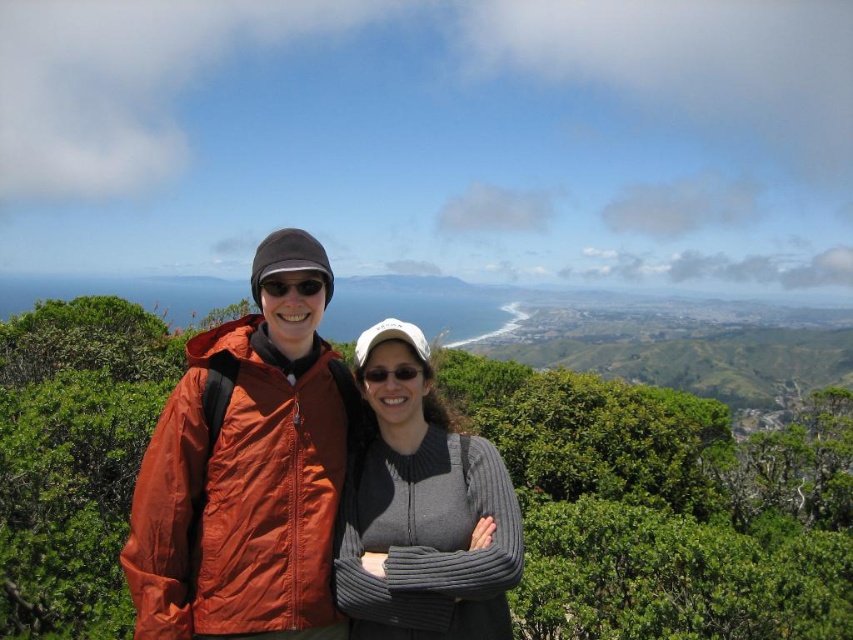
You are a photographer trying to capture a clear shot of the gray ribbed sweater at center and the matte black sunglasses at center. Since both are at the center, which object should you focus on to ensure the other is also in focus?

The gray ribbed sweater at center is in front of matte black sunglasses at center. To ensure both are in focus, focus on the gray ribbed sweater at center since it is closer to the camera, and the depth of field will likely include the matte black sunglasses at center behind it.

You are a photographer trying to capture a candid shot of the two hikers. You notice the gray ribbed sweater at center and the matte black sunglasses at center in your frame. From the photographer perspective, which item is positioned to the right of the other?

The gray ribbed sweater at center is positioned to the right of the matte black sunglasses at center.